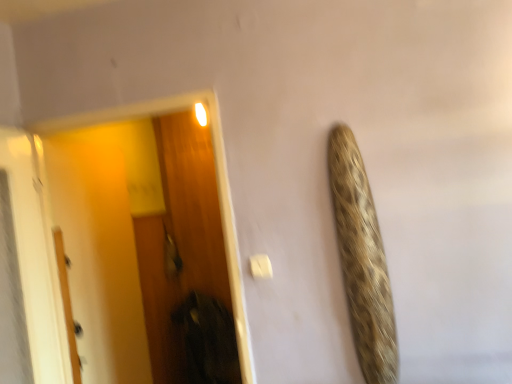
Question: From the image's perspective, is white matte door at left under wooden screen door at left?

Choices:
 (A) no
 (B) yes

Answer: (B)

Question: Does white matte door at left have a lesser width compared to wooden screen door at left?

Choices:
 (A) yes
 (B) no

Answer: (A)

Question: Could you tell me if white matte door at left is turned towards wooden screen door at left?

Choices:
 (A) yes
 (B) no

Answer: (B)

Question: Can you confirm if white matte door at left is taller than wooden screen door at left?

Choices:
 (A) yes
 (B) no

Answer: (B)

Question: Would you consider white matte door at left to be distant from wooden screen door at left?

Choices:
 (A) yes
 (B) no

Answer: (B)

Question: Is white matte door at left oriented away from wooden screen door at left?

Choices:
 (A) no
 (B) yes

Answer: (A)

Question: Is wooden screen door at left further to the viewer compared to white matte door at left?

Choices:
 (A) yes
 (B) no

Answer: (B)

Question: Is wooden screen door at left to the left of white matte door at left from the viewer's perspective?

Choices:
 (A) no
 (B) yes

Answer: (A)

Question: Is wooden screen door at left not close to white matte door at left?

Choices:
 (A) no
 (B) yes

Answer: (A)

Question: Is wooden screen door at left smaller than white matte door at left?

Choices:
 (A) yes
 (B) no

Answer: (B)

Question: Is wooden screen door at left oriented away from white matte door at left?

Choices:
 (A) yes
 (B) no

Answer: (A)

Question: From the image's perspective, would you say wooden screen door at left is positioned over white matte door at left?

Choices:
 (A) no
 (B) yes

Answer: (B)

Question: Is white matte door at left taller or shorter than wooden screen door at left?

Choices:
 (A) tall
 (B) short

Answer: (B)